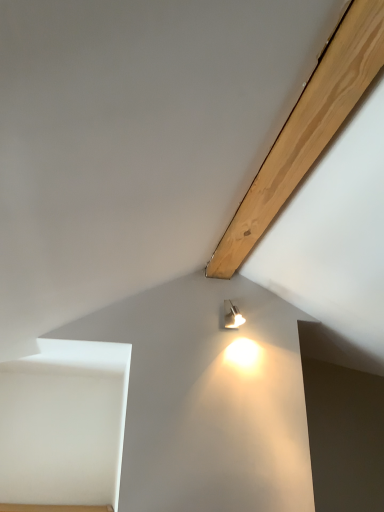
Question: From the image's perspective, is natural wood beam at upper right above or below matte silver lamp at upper right?

Choices:
 (A) above
 (B) below

Answer: (A)

Question: Is point (226, 242) closer or farther from the camera than point (226, 324)?

Choices:
 (A) farther
 (B) closer

Answer: (B)

Question: Considering the positions of natural wood beam at upper right and matte silver lamp at upper right in the image, is natural wood beam at upper right taller or shorter than matte silver lamp at upper right?

Choices:
 (A) tall
 (B) short

Answer: (B)

Question: Is matte silver lamp at upper right taller or shorter than natural wood beam at upper right?

Choices:
 (A) short
 (B) tall

Answer: (B)

Question: Based on their sizes in the image, would you say matte silver lamp at upper right is bigger or smaller than natural wood beam at upper right?

Choices:
 (A) big
 (B) small

Answer: (B)

Question: Looking at their shapes, would you say matte silver lamp at upper right is wider or thinner than natural wood beam at upper right?

Choices:
 (A) thin
 (B) wide

Answer: (B)

Question: From the image's perspective, is matte silver lamp at upper right above or below natural wood beam at upper right?

Choices:
 (A) below
 (B) above

Answer: (A)